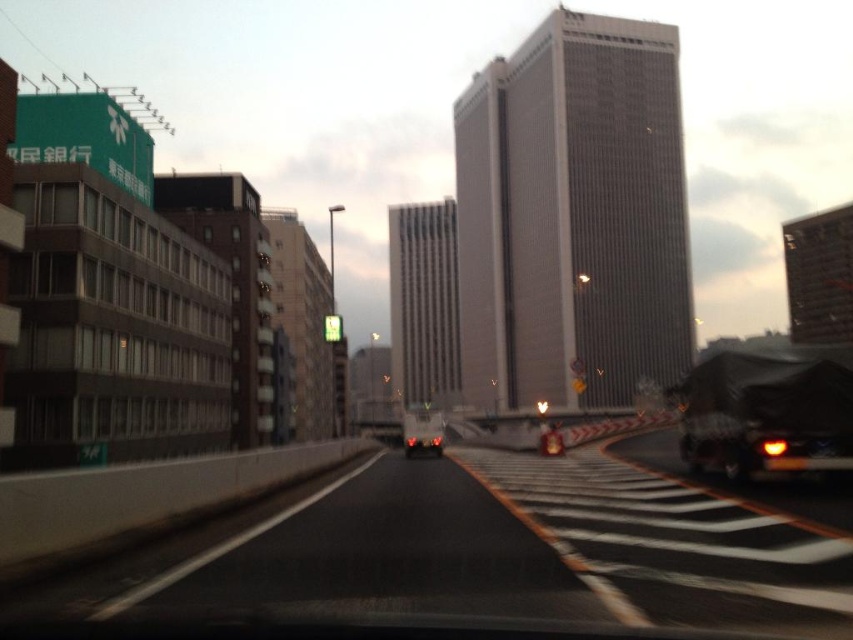
You are a driver looking at the road ahead. You see a black asphalt highway at center and a matte black car at center. Which one is positioned to the right of the other?

The black asphalt highway at center is positioned to the right of the matte black car at center.

You are driving a car and need to pass the black matte truck at right on the black asphalt highway at center. Based on the road width, is it safe to do so without crossing the solid lines?

The black asphalt highway at center might be wider than black matte truck at right, so it could be possible to pass safely without crossing the solid lines if the highway has enough space. However, the exact width isn not specified, so caution is advised.

You are a delivery driver who needs to park your vehicle. You see a black matte truck at right and a matte black car at center. Which vehicle has more space available for parking next to it?

The black matte truck at right has a smaller size compared to the matte black car at center, so the matte black car at center has more space available for parking next to it.